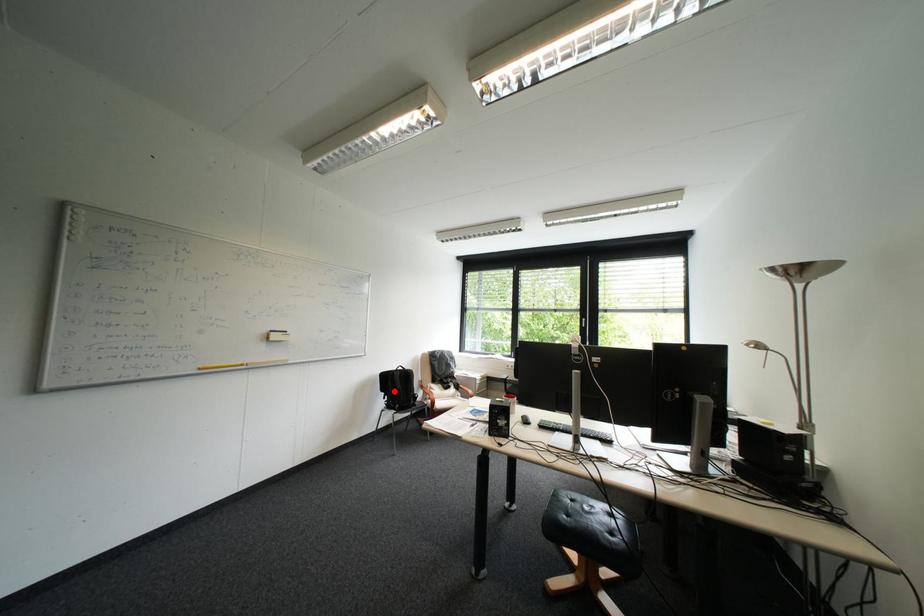
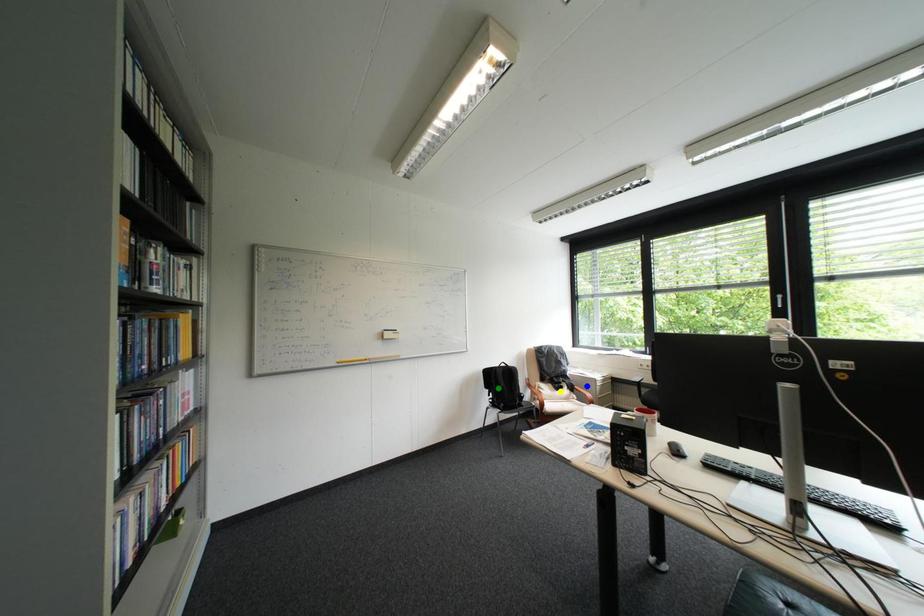
Question: I am providing you with two images of the same scene from different viewpoints. A red point is marked on the first image. You are given multiple points on the second image. Which point in image 2 is actually the same real-world point as the red point in image 1?

Choices:
 (A) yellow point
 (B) blue point
 (C) green point

Answer: (C)